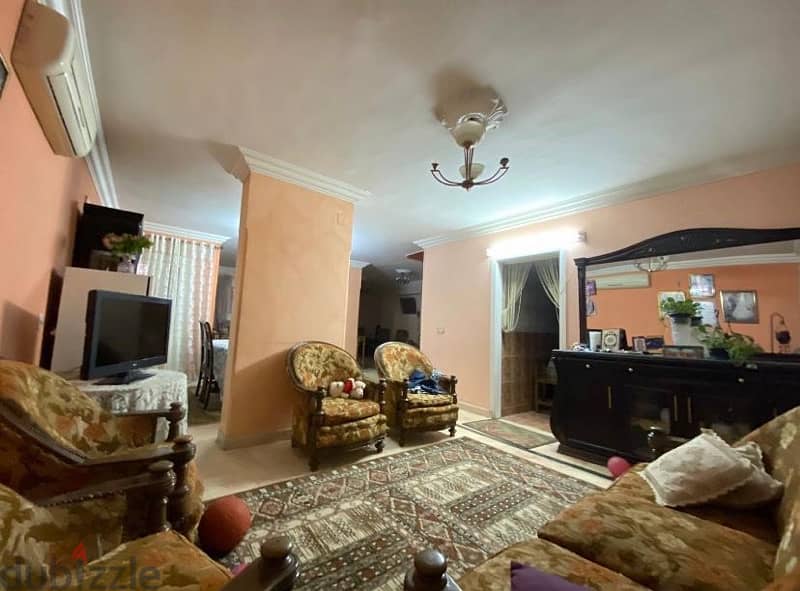
At what (x,y) coordinates should I click in order to perform the action: click on chairs. Please return your answer as a coordinate pair (x, y). Image resolution: width=800 pixels, height=591 pixels. Looking at the image, I should click on (437, 399), (346, 411), (124, 436), (140, 563), (208, 374), (200, 368), (222, 324).